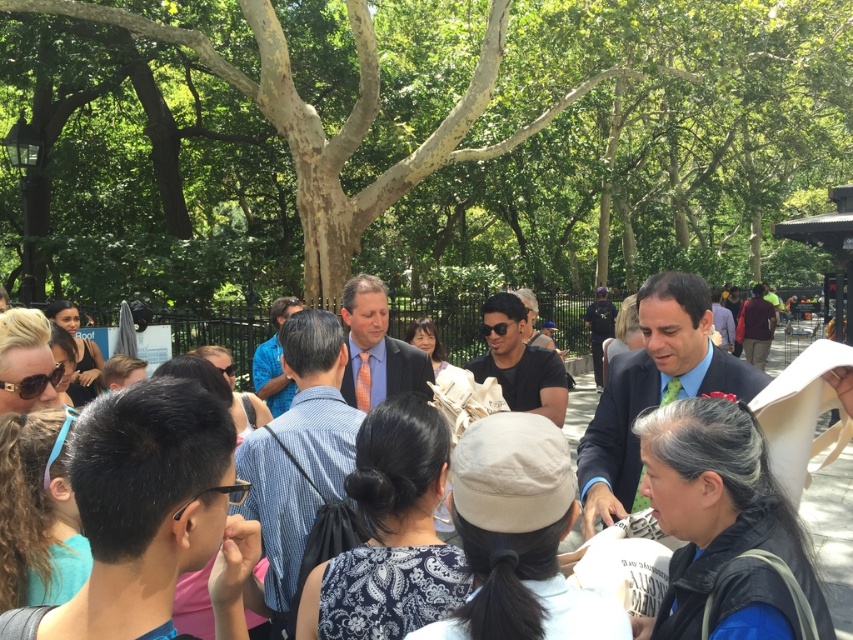
Does point (322, 388) lie behind point (625, 396)?

That is False.

I want to click on orange tie at center, so click(299, 451).

Who is lower down, blue striped shirt at center or blue shirt at center?

blue striped shirt at center

Who is more distant from viewer, [827,387] or [282,394]?

Positioned behind is point [282,394].

This screenshot has height=640, width=853. What are the coordinates of `blue striped shirt at center` in the screenshot? It's located at (834, 534).

Who is shorter, green silk suit at center or blue striped shirt at center?

green silk suit at center is shorter.

Which is below, green silk suit at center or blue striped shirt at center?

blue striped shirt at center

Which is behind, point (721, 374) or point (183, 632)?

The point (721, 374) is behind.

This screenshot has width=853, height=640. In order to click on green silk suit at center in this screenshot , I will do `click(653, 387)`.